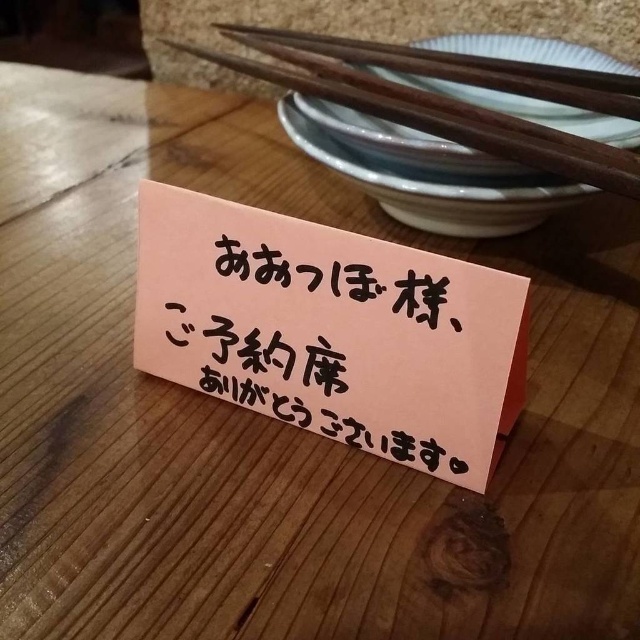
Is pink paper sign at center further to the viewer compared to wooden chopsticks at upper right?

No, it is in front of wooden chopsticks at upper right.

Between pink paper sign at center and wooden chopsticks at upper right, which one has less height?

pink paper sign at center

Locate an element on the screen. pink paper sign at center is located at coordinates click(x=330, y=330).